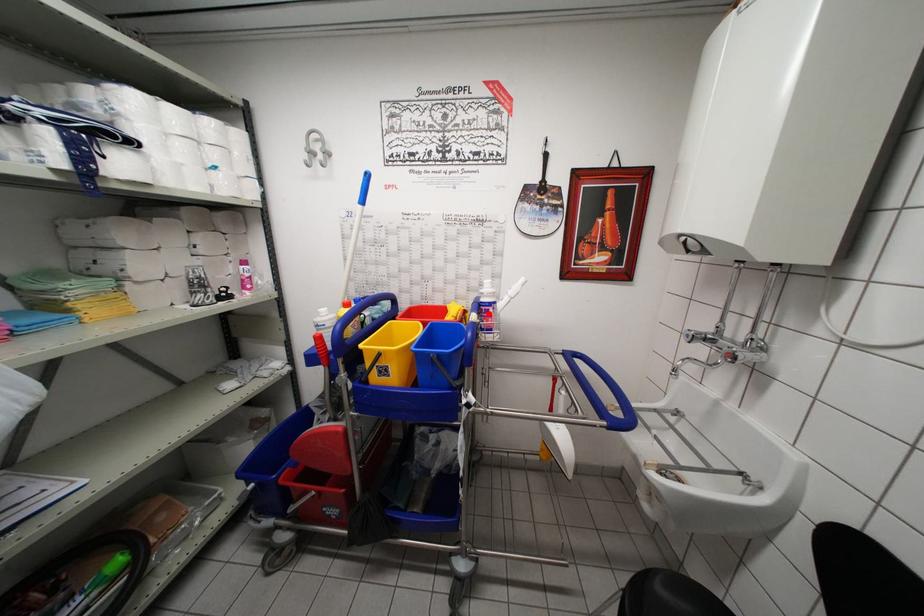
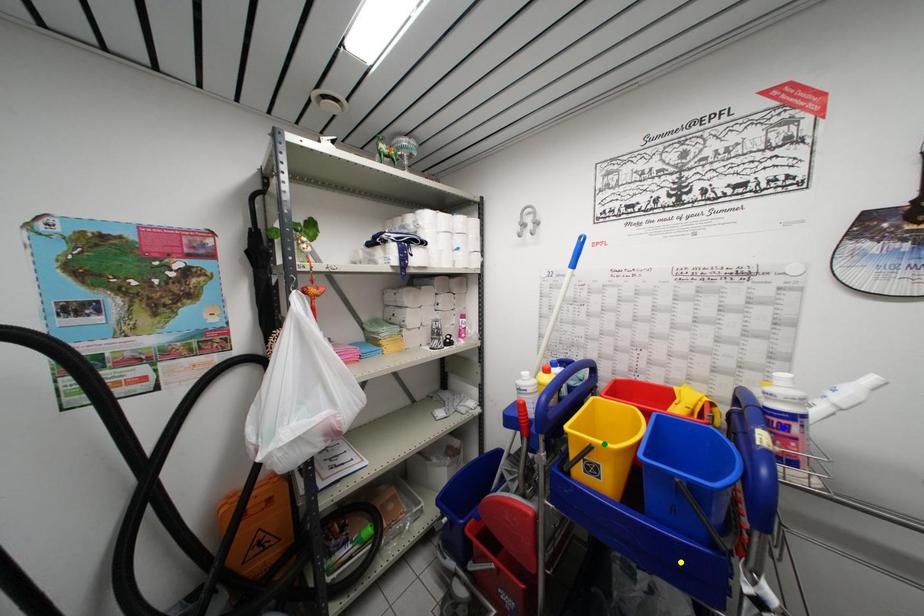
Question: I am providing you with two images of the same scene from different viewpoints. A red point is marked on the first image. You are given multiple points on the second image. Which spot in image 2 lines up with the point in image 1?

Choices:
 (A) yellow point
 (B) blue point
 (C) green point

Answer: (B)